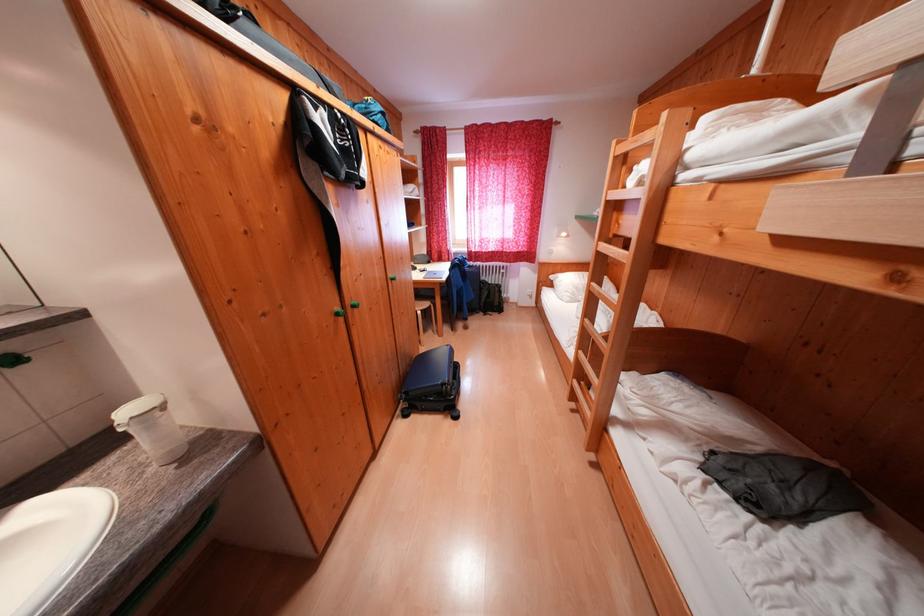
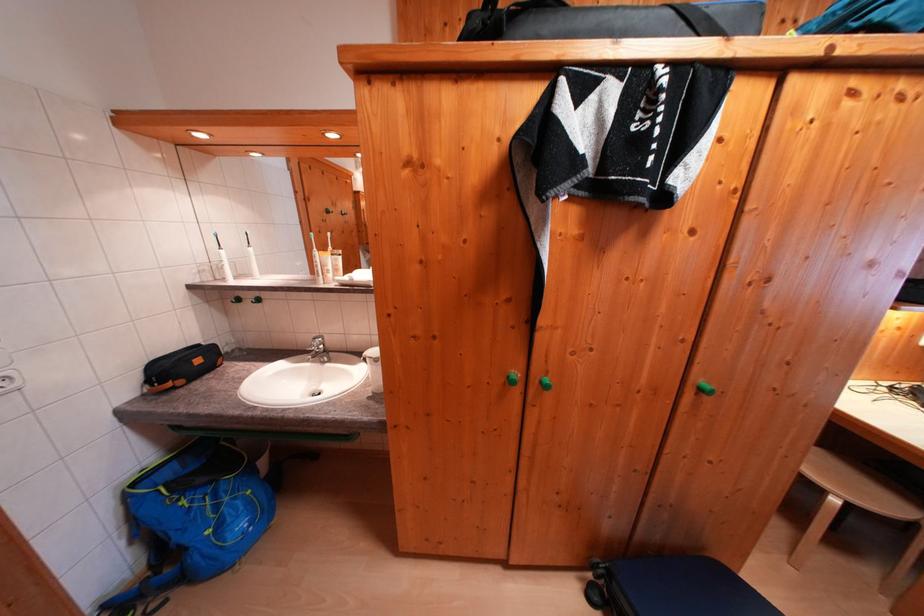
How did the camera likely rotate?

The camera's rotation is toward left-down.